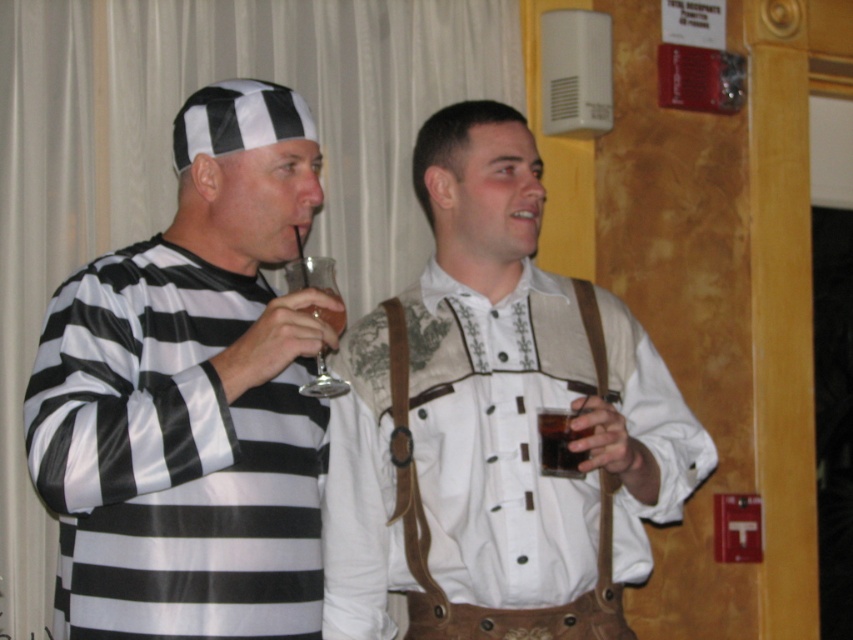
Who is higher up, white leather suspenders at center or translucent glass at upper center?

translucent glass at upper center is above.

Identify the location of white leather suspenders at center. (495, 420).

Locate an element on the screen. This screenshot has height=640, width=853. white leather suspenders at center is located at coordinates click(495, 420).

Does clear glass wine glass at center appear on the right side of dark brown liquid at right?

No, clear glass wine glass at center is not to the right of dark brown liquid at right.

Does clear glass wine glass at center have a lesser width compared to dark brown liquid at right?

No.

Who is more forward, (x=325, y=269) or (x=567, y=419)?

Positioned in front is point (x=325, y=269).

The width and height of the screenshot is (853, 640). What are the coordinates of `clear glass wine glass at center` in the screenshot? It's located at (311, 275).

Does dark brown liquid at right appear over translucent glass at upper center?

Actually, dark brown liquid at right is below translucent glass at upper center.

Can you confirm if dark brown liquid at right is bigger than translucent glass at upper center?

Incorrect, dark brown liquid at right is not larger than translucent glass at upper center.

Is point (569, 472) closer to camera compared to point (334, 296)?

No, (569, 472) is further to viewer.

The image size is (853, 640). Identify the location of dark brown liquid at right. (560, 442).